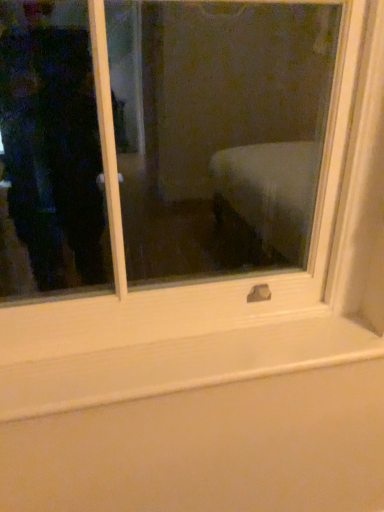
The image size is (384, 512). What are the coordinates of `white matte bathtub at lower center` in the screenshot? It's located at (202, 423).

Describe the element at coordinates (202, 423) in the screenshot. I see `white matte bathtub at lower center` at that location.

Find the location of a particular element. The width and height of the screenshot is (384, 512). white matte bathtub at lower center is located at coordinates (202, 423).